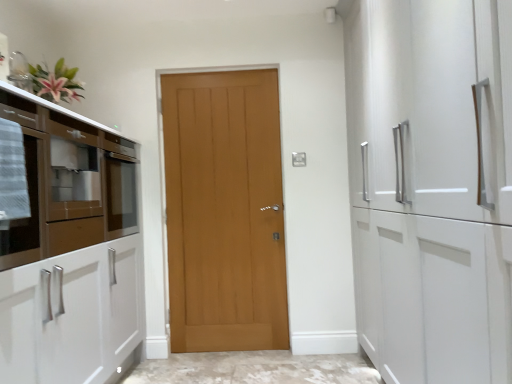
Question: From a real-world perspective, does matte glass cabinet at left sit lower than light brown wood door at center?

Choices:
 (A) yes
 (B) no

Answer: (B)

Question: Is matte glass cabinet at left oriented towards light brown wood door at center?

Choices:
 (A) no
 (B) yes

Answer: (B)

Question: Is matte glass cabinet at left facing away from light brown wood door at center?

Choices:
 (A) yes
 (B) no

Answer: (B)

Question: Is matte glass cabinet at left directly adjacent to light brown wood door at center?

Choices:
 (A) yes
 (B) no

Answer: (B)

Question: Is matte glass cabinet at left taller than light brown wood door at center?

Choices:
 (A) no
 (B) yes

Answer: (A)

Question: Does matte glass cabinet at left have a smaller size compared to light brown wood door at center?

Choices:
 (A) yes
 (B) no

Answer: (B)

Question: Is light brown wood door at center thinner than matte glass cabinet at left?

Choices:
 (A) yes
 (B) no

Answer: (A)

Question: Can you see light brown wood door at center touching matte glass cabinet at left?

Choices:
 (A) no
 (B) yes

Answer: (A)

Question: Is light brown wood door at center closer to the viewer compared to matte glass cabinet at left?

Choices:
 (A) yes
 (B) no

Answer: (B)

Question: Is the position of light brown wood door at center more distant than that of matte glass cabinet at left?

Choices:
 (A) no
 (B) yes

Answer: (B)

Question: Is matte glass cabinet at left located within light brown wood door at center?

Choices:
 (A) no
 (B) yes

Answer: (A)

Question: Is light brown wood door at center positioned with its back to matte glass cabinet at left?

Choices:
 (A) no
 (B) yes

Answer: (A)

Question: In terms of height, does light brown wood door at center look taller or shorter compared to matte glass cabinet at left?

Choices:
 (A) tall
 (B) short

Answer: (A)